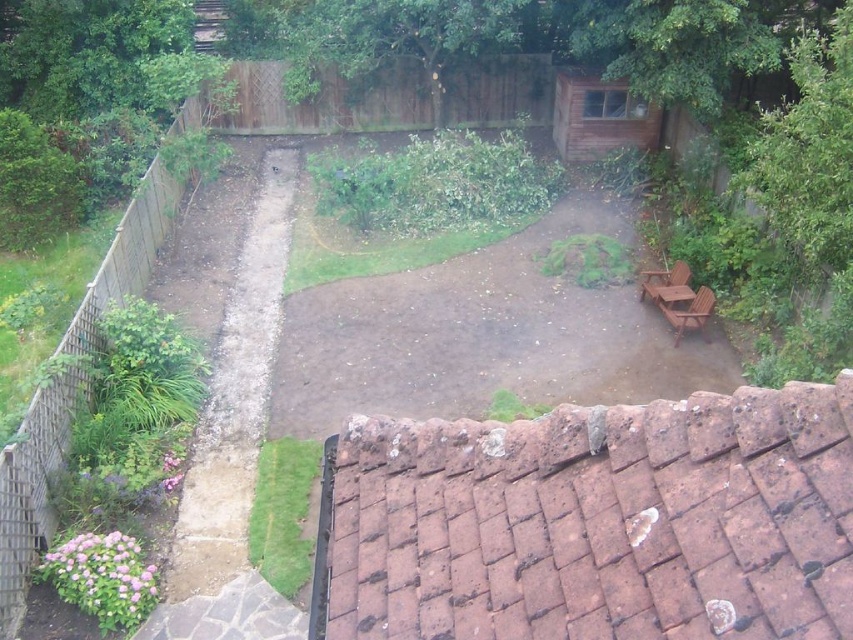
You are standing in the backyard garden and want to place a small statue exactly halfway between point (802,124) and point (555,81). Considering their positions, will the statue be closer to the roof edge or the raised bed with green plants and pink flowers?

The statue placed halfway between point (802,124) and point (555,81) will be closer to the roof edge because point (802,124) is closer to the viewer than point (555,81). Since the roof edge is part of the foreground, the midpoint remains nearer to that area.

You are standing at the edge of the roof with reddish brown tiles and want to walk to the green leafy tree at upper right. The path is 10 meters long. Will you reach the tree before the path ends?

The green leafy tree at upper right is 9.98 meters from the camera, so yes, you will reach the tree before the path ends since it is slightly shorter than the 10 meter path.

You are planning to install a new garden bench in the backyard. The bench requires a space wider than the green leafy tree at upper right. Is there enough space near the green leafy tree at upper center to accommodate it?

The green leafy tree at upper right is wider than the green leafy tree at upper center. Therefore, the space near the green leafy tree at upper center may not be wide enough to accommodate the bench that requires a space wider than the green leafy tree at upper right.